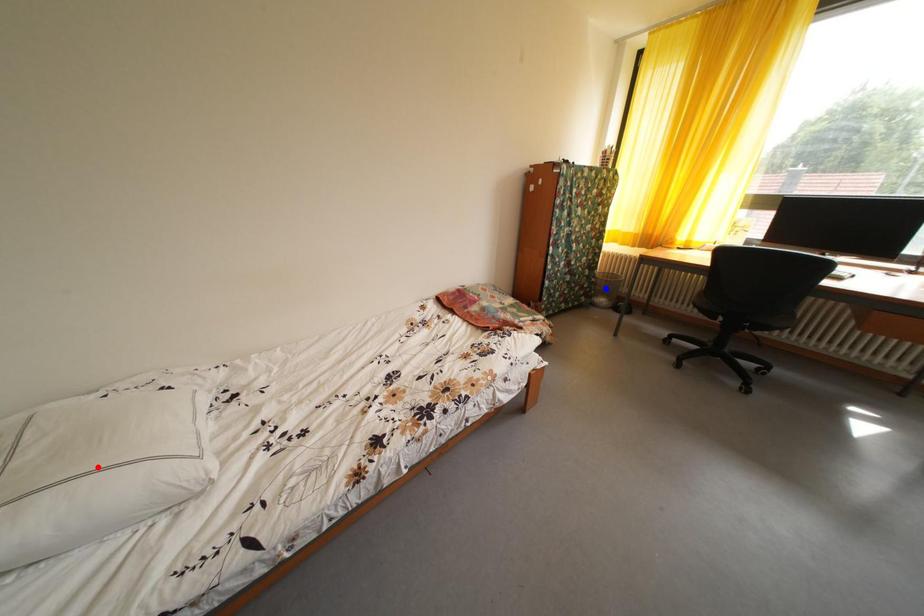
Question: Which of the two points in the image is closer to the camera?

Choices:
 (A) Blue point is closer.
 (B) Red point is closer.

Answer: (B)